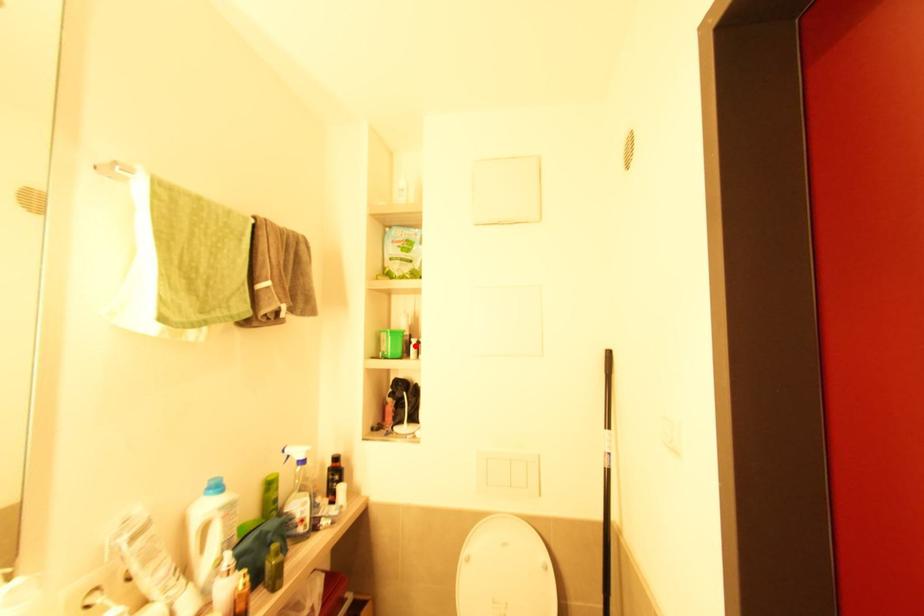
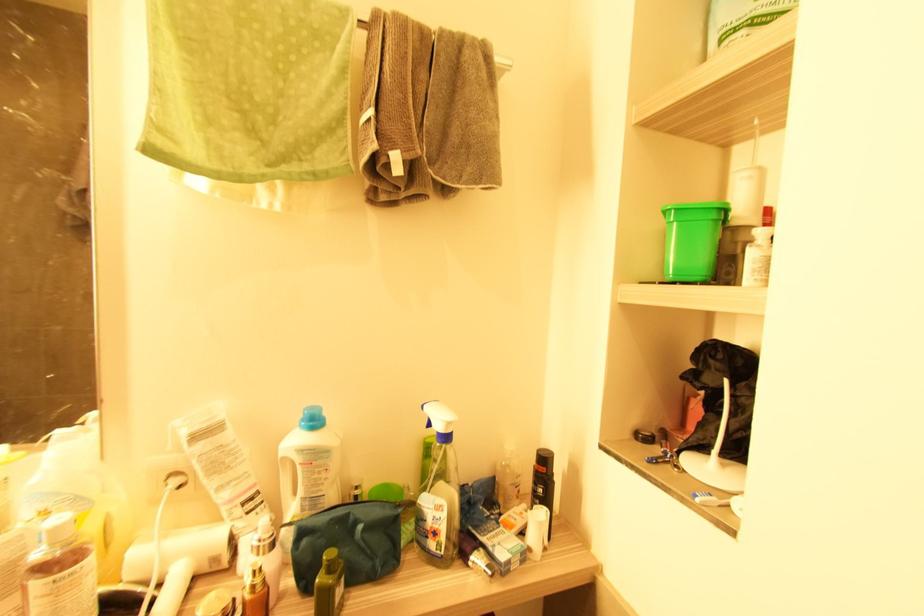
In the second image, find the point that corresponds to the highlighted location in the first image.

(760, 246)